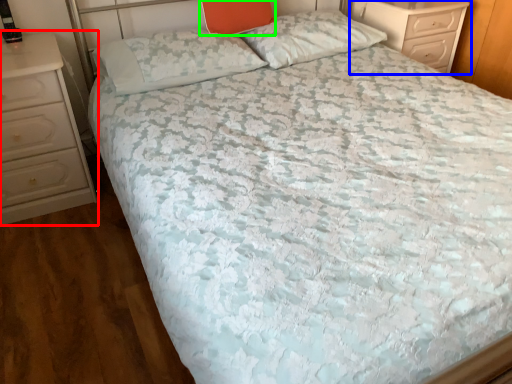
Question: Which object is the farthest from chest of drawers (highlighted by a red box)? Choose among these: chest of drawers (highlighted by a blue box) or pillow (highlighted by a green box).

Choices:
 (A) chest of drawers
 (B) pillow

Answer: (A)